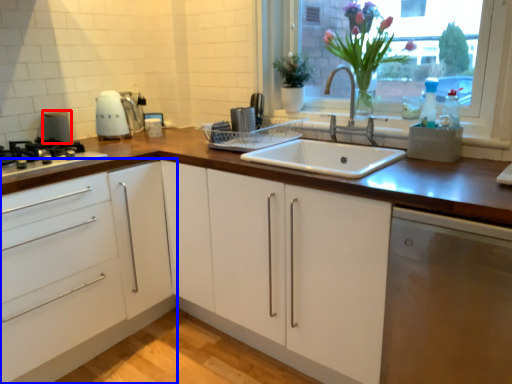
Question: Which object appears closest to the camera in this image, appliance (highlighted by a red box) or cabinetry (highlighted by a blue box)?

Choices:
 (A) appliance
 (B) cabinetry

Answer: (B)